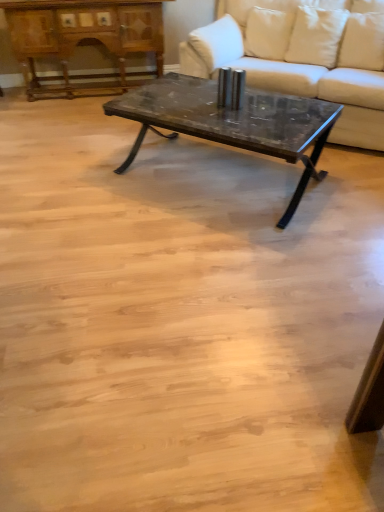
Find the location of `free space above dark gray stone coffee table at center (from a real-world perspective)`. free space above dark gray stone coffee table at center (from a real-world perspective) is located at coordinates (230, 112).